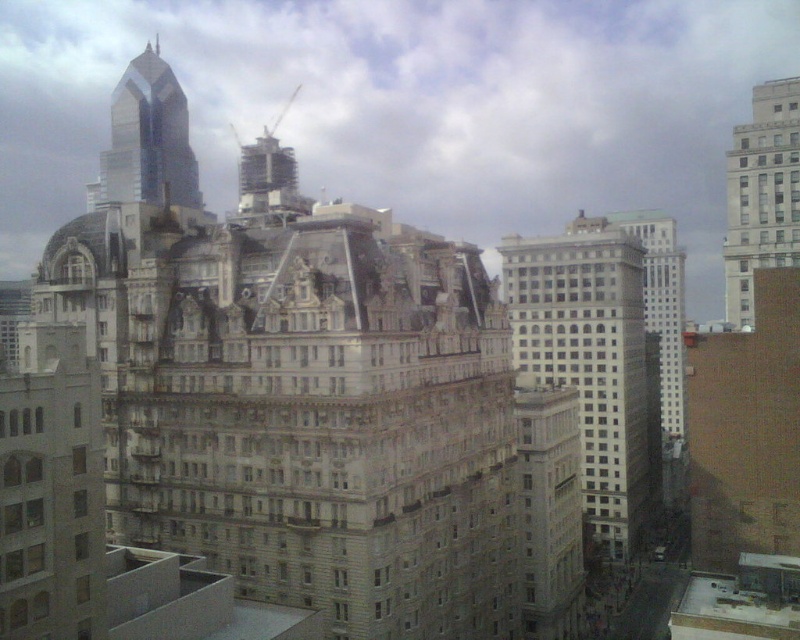
Between gray stone building at center and shiny glass skyscraper at upper left, which one has more height?

shiny glass skyscraper at upper left is taller.

Is point (626, 298) positioned after point (126, 170)?

That is False.

Which is behind, point (521, 342) or point (104, 156)?

Positioned behind is point (104, 156).

Where is `gray stone building at center`? The height and width of the screenshot is (640, 800). gray stone building at center is located at coordinates click(x=594, y=365).

Between gray stone building at center and white stone building at upper right, which one is positioned higher?

white stone building at upper right

Between point (641, 525) and point (741, 189), which one is positioned in front?

Point (741, 189) is more forward.

Describe the element at coordinates (594, 365) in the screenshot. I see `gray stone building at center` at that location.

Find the location of a particular element. The width and height of the screenshot is (800, 640). gray stone building at center is located at coordinates (594, 365).

Does white stone building at upper right appear on the left side of shiny glass skyscraper at upper left?

In fact, white stone building at upper right is to the right of shiny glass skyscraper at upper left.

The image size is (800, 640). Describe the element at coordinates (762, 193) in the screenshot. I see `white stone building at upper right` at that location.

Between point (754, 252) and point (122, 198), which one is positioned in front?

Point (754, 252)

The height and width of the screenshot is (640, 800). I want to click on white stone building at upper right, so click(x=762, y=193).